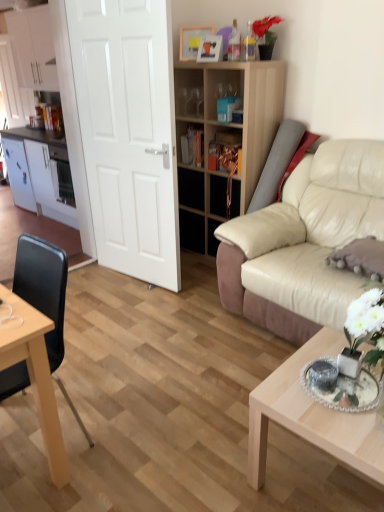
Question: In the image, is white glossy cabinet at upper left, the third cabinetry in the bottom-to-top sequence, positioned in front of or behind white glossy cabinet at left, which appears as the 2th cabinetry when viewed from the top?

Choices:
 (A) front
 (B) behind

Answer: (A)

Question: From the image's perspective, is white glossy cabinet at upper left, the 1th cabinetry viewed from the top, positioned above or below white glossy cabinet at left, which is the 2th cabinetry from bottom to top?

Choices:
 (A) below
 (B) above

Answer: (B)

Question: Which object is positioned farthest from the white glossy cabinet at upper left, the 1th cabinetry viewed from the top?

Choices:
 (A) black leather chair at left
 (B) white glossy cabinet at left, which appears as the 2th cabinetry when viewed from the top
 (C) gray suede pillow at right
 (D) white matte door at center
 (E) beige leather couch at right

Answer: (C)

Question: Estimate the real-world distances between objects in this image. Which object is farther from the black leather chair at left?

Choices:
 (A) wooden shelf at center
 (B) beige leather couch at right
 (C) white glossy cabinet at upper left, the third cabinetry in the bottom-to-top sequence
 (D) white matte door at center
 (E) white glossy cabinet at left, which is the 2th cabinetry from bottom to top

Answer: (E)